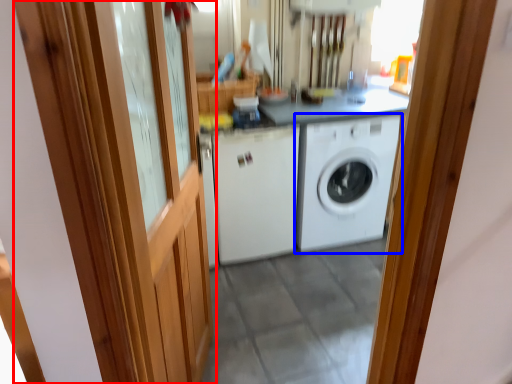
Question: Which object appears closest to the camera in this image, barn door (highlighted by a red box) or washing machine (highlighted by a blue box)?

Choices:
 (A) barn door
 (B) washing machine

Answer: (A)